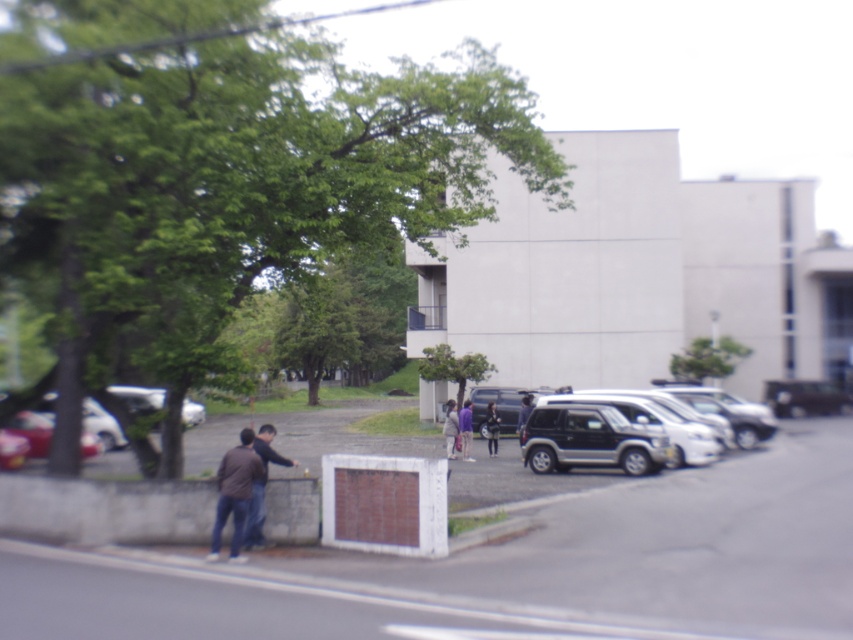
Which is above, brown leather jacket at lower left or dark blue jeans at center?

dark blue jeans at center is higher up.

Who is lower down, brown leather jacket at lower left or dark blue jeans at center?

brown leather jacket at lower left

The width and height of the screenshot is (853, 640). Describe the element at coordinates (234, 493) in the screenshot. I see `brown leather jacket at lower left` at that location.

What are the coordinates of `brown leather jacket at lower left` in the screenshot? It's located at (234, 493).

Which is above, satin silver suv at right or silver metallic car at left?

Positioned higher is silver metallic car at left.

Who is positioned more to the right, satin silver suv at right or silver metallic car at left?

Positioned to the right is satin silver suv at right.

Measure the distance between satin silver suv at right and camera.

61.64 feet

You are a GUI agent. You are given a task and a screenshot of the screen. Output one action in this format:
    pyautogui.click(x=<x>, y=<y>)
    Task: Click on the satin silver suv at right
    Image resolution: width=853 pixels, height=640 pixels.
    Given the screenshot: What is the action you would take?
    pyautogui.click(x=590, y=440)

Is metallic silver suv at right positioned behind matte black suv at center?

Yes, metallic silver suv at right is further from the viewer.

Is point (827, 400) farther from camera compared to point (489, 396)?

Yes, point (827, 400) is behind point (489, 396).

Between point (801, 410) and point (473, 429), which one is positioned behind?

Positioned behind is point (801, 410).

Image resolution: width=853 pixels, height=640 pixels. What are the coordinates of `metallic silver suv at right` in the screenshot? It's located at (804, 397).